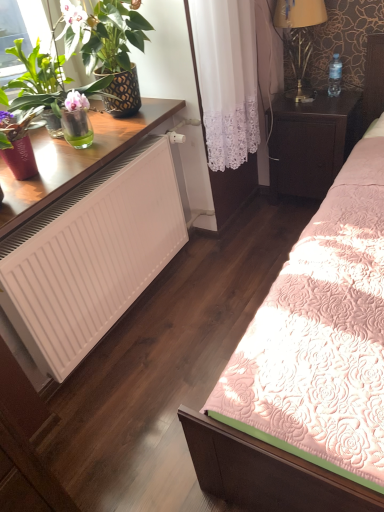
The image size is (384, 512). Identify the location of free space to the left of dark wood nightstand at right. (261, 211).